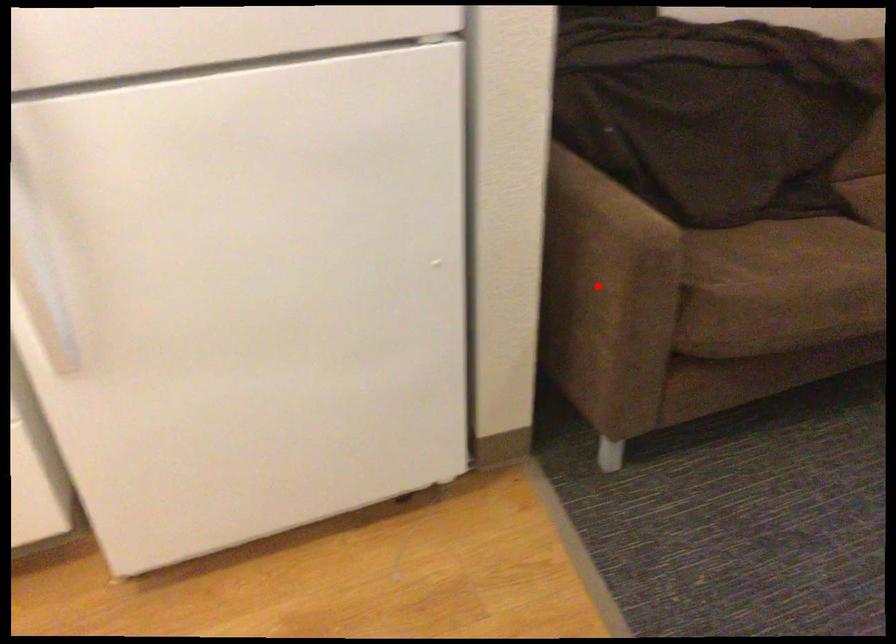
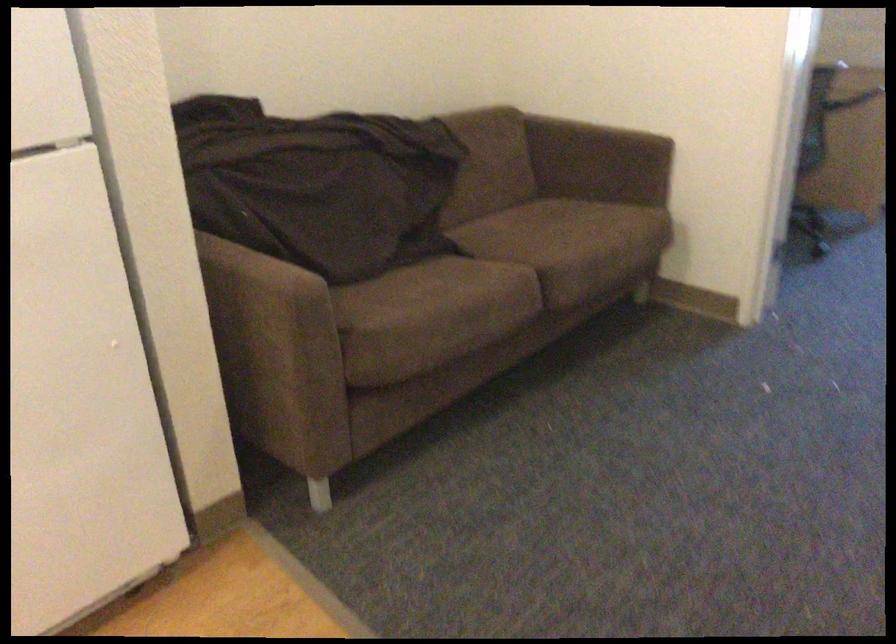
Locate, in the second image, the point that corresponds to the highlighted location in the first image.

(271, 342)